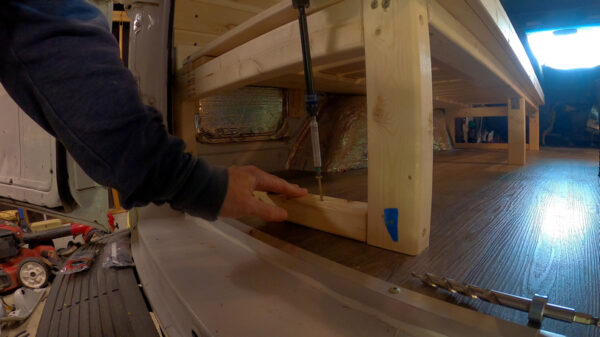
Where is `floor`? This screenshot has width=600, height=337. floor is located at coordinates (490, 217).